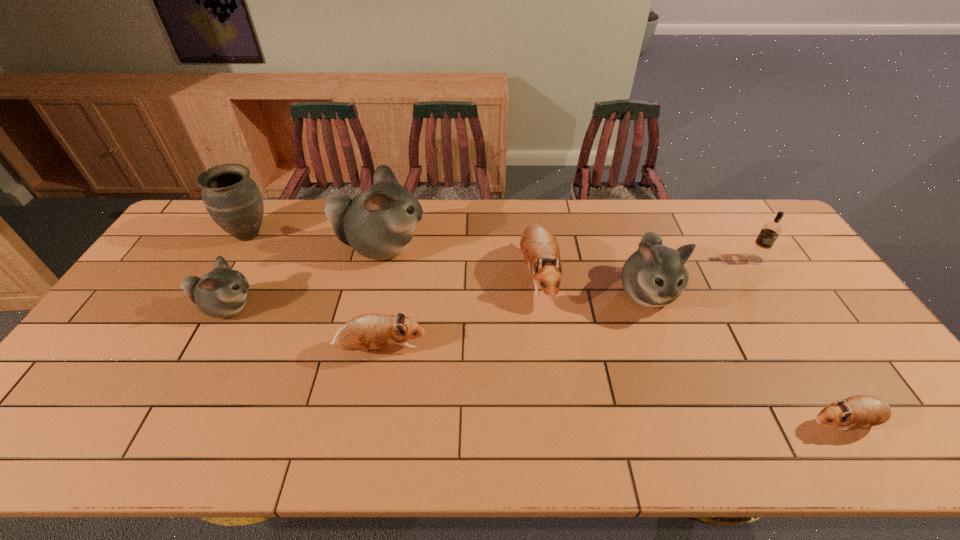
The width and height of the screenshot is (960, 540). I want to click on vacant region between the vodka and the rightmost brown hamster, so click(800, 341).

Where is `vacant region between the second tallest hamster and the second biggest brown hamster`? The width and height of the screenshot is (960, 540). vacant region between the second tallest hamster and the second biggest brown hamster is located at coordinates (514, 321).

Where is `free space between the seventh farthest object and the urn`? This screenshot has width=960, height=540. free space between the seventh farthest object and the urn is located at coordinates (315, 292).

Where is `free point between the second brown hamster from right to left and the seventh farthest object`? free point between the second brown hamster from right to left and the seventh farthest object is located at coordinates (459, 312).

Locate an element on the screen. The width and height of the screenshot is (960, 540). vacant space that's between the farthest brown hamster and the second tallest hamster is located at coordinates (592, 284).

Find the location of `vacant area that lies between the leftmost brown hamster and the tallest hamster`. vacant area that lies between the leftmost brown hamster and the tallest hamster is located at coordinates (381, 299).

Identify the location of blank region between the vodka and the second white hamster from left to right. (568, 253).

Identify which object is located as the nearest to the biggest brown hamster. Please provide its 2D coordinates. Your answer should be formatted as a tuple, i.e. [(x, y)], where the tuple contains the x and y coordinates of a point satisfying the conditions above.

[(653, 276)]

Identify the location of object that is the fifth closest to the shortest hamster. The width and height of the screenshot is (960, 540). (378, 223).

Locate an element on the screen. The width and height of the screenshot is (960, 540). hamster that stands as the closest to the vodka is located at coordinates (653, 276).